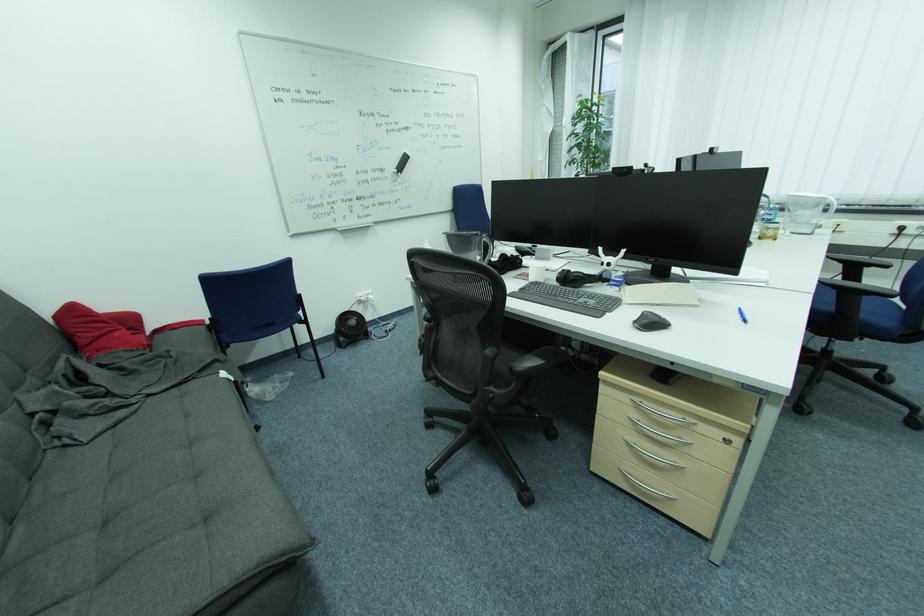
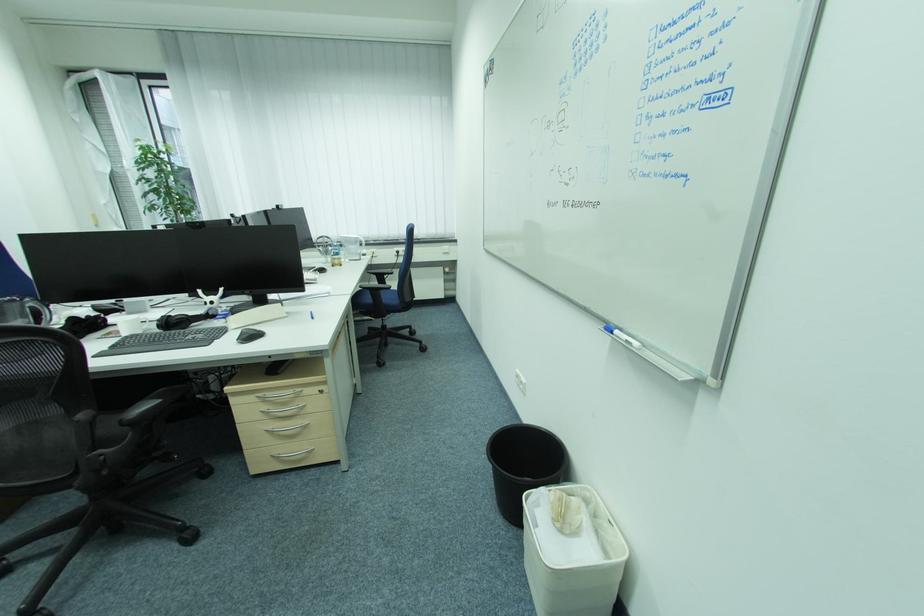
Where in the second image is the point corresponding to pixel 565 280 from the first image?

(166, 328)